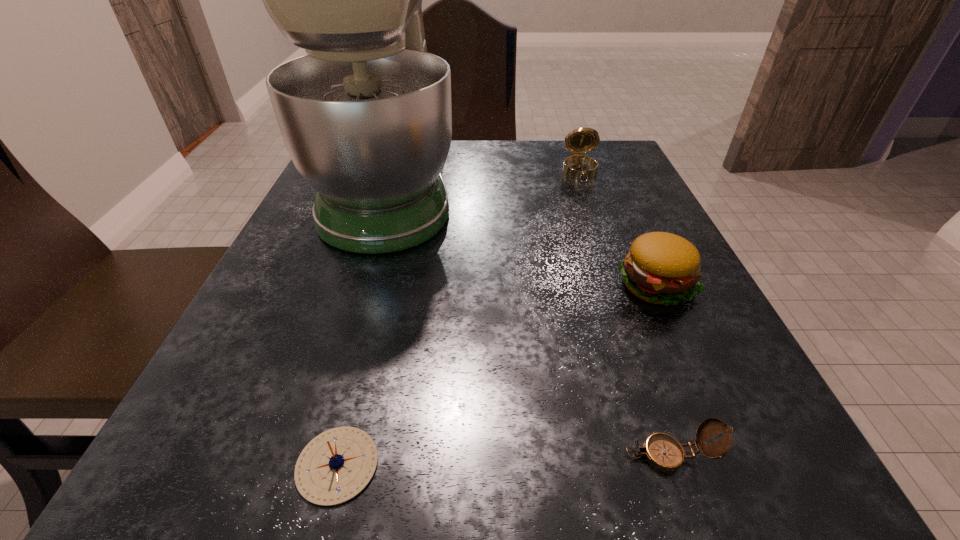
You are a GUI agent. You are given a task and a screenshot of the screen. Output one action in this format:
    pyautogui.click(x=<x>, y=<y>)
    Task: Click on the compass present at the far edge
    This screenshot has width=960, height=540.
    Given the screenshot: What is the action you would take?
    pyautogui.click(x=582, y=140)

At what (x,y) coordinates should I click in order to perform the action: click on mixer at the left edge. Please return your answer as a coordinate pair (x, y). The width and height of the screenshot is (960, 540). Looking at the image, I should click on (366, 117).

This screenshot has width=960, height=540. I want to click on compass present at the left edge, so click(x=335, y=466).

The height and width of the screenshot is (540, 960). Identify the location of hamburger that is positioned at the right edge. (662, 268).

The image size is (960, 540). I want to click on object positioned at the far left corner, so click(x=366, y=117).

Locate an element on the screen. The height and width of the screenshot is (540, 960). object that is at the near left corner is located at coordinates (335, 466).

At what (x,y) coordinates should I click in order to perform the action: click on object positioned at the far right corner. Please return your answer as a coordinate pair (x, y). Image resolution: width=960 pixels, height=540 pixels. Looking at the image, I should click on (582, 140).

Locate an element on the screen. Image resolution: width=960 pixels, height=540 pixels. object at the near right corner is located at coordinates (662, 451).

Find the location of a particular element. vacant position at the far edge of the desktop is located at coordinates (511, 171).

At what (x,y) coordinates should I click in order to perform the action: click on vacant space at the left edge. Please return your answer as a coordinate pair (x, y). Looking at the image, I should click on (309, 399).